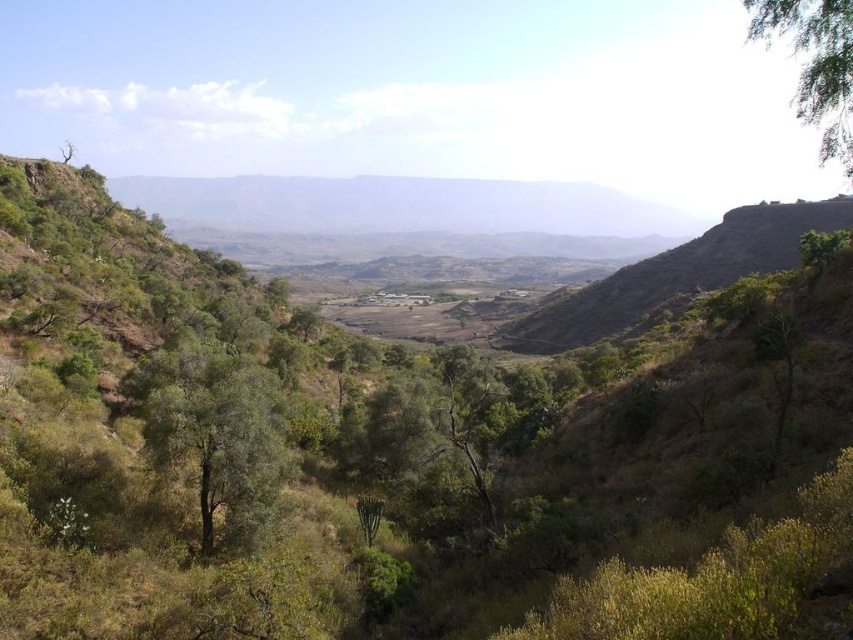
Between green leafy tree at center and green leafy tree at upper right, which one appears on the right side from the viewer's perspective?

Positioned to the right is green leafy tree at upper right.

Can you confirm if green leafy tree at center is wider than green leafy tree at upper right?

No.

Locate an element on the screen. This screenshot has height=640, width=853. green leafy tree at center is located at coordinates 216,435.

At what (x,y) coordinates should I click in order to perform the action: click on green leafy tree at center. Please return your answer as a coordinate pair (x, y). Looking at the image, I should click on (216, 435).